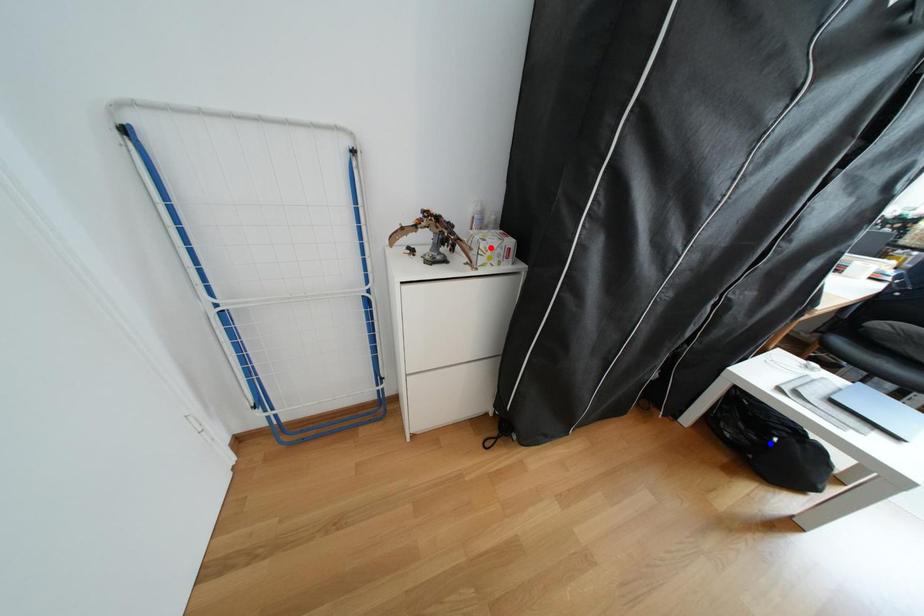
Question: Two points are marked on the image. Which point is closer to the camera?

Choices:
 (A) Blue point is closer.
 (B) Red point is closer.

Answer: (B)